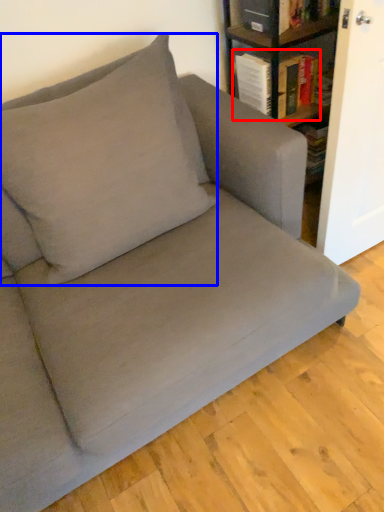
Question: Which object is closer to the camera taking this photo, book (highlighted by a red box) or throw pillow (highlighted by a blue box)?

Choices:
 (A) book
 (B) throw pillow

Answer: (B)